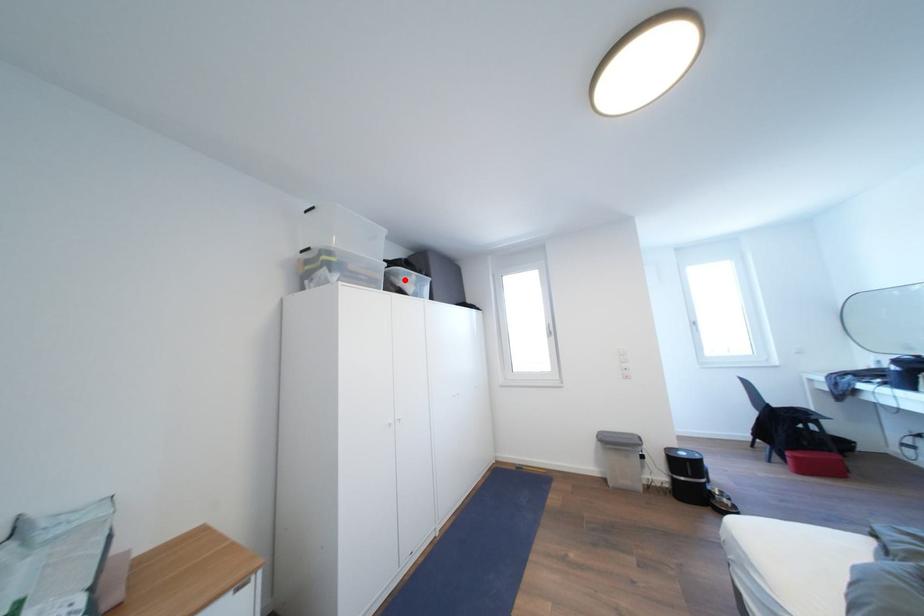
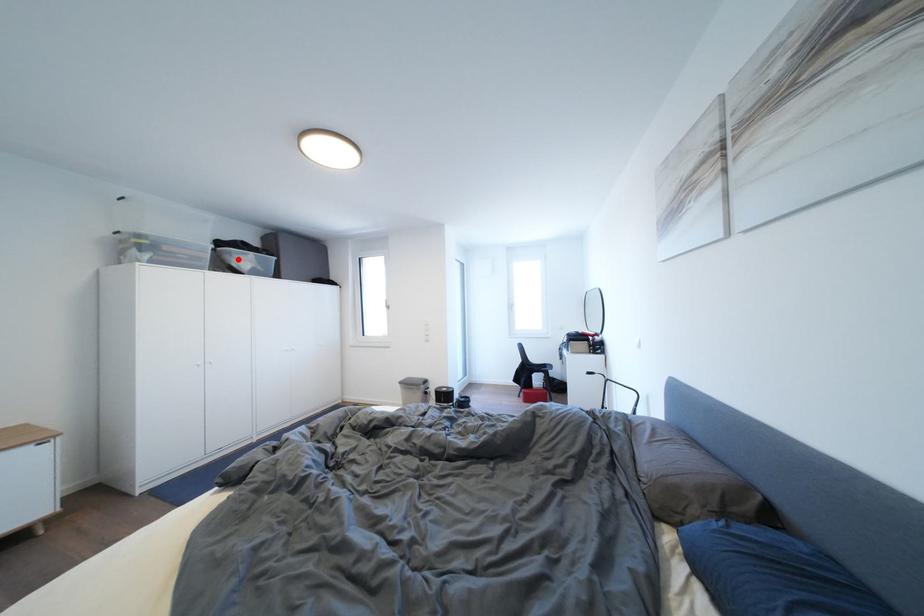
I am providing you with two images of the same scene from different viewpoints. A red point is marked on the first image and another point is marked on the second image. Are the points marked in image1 and image2 representing the same 3D position?

Yes